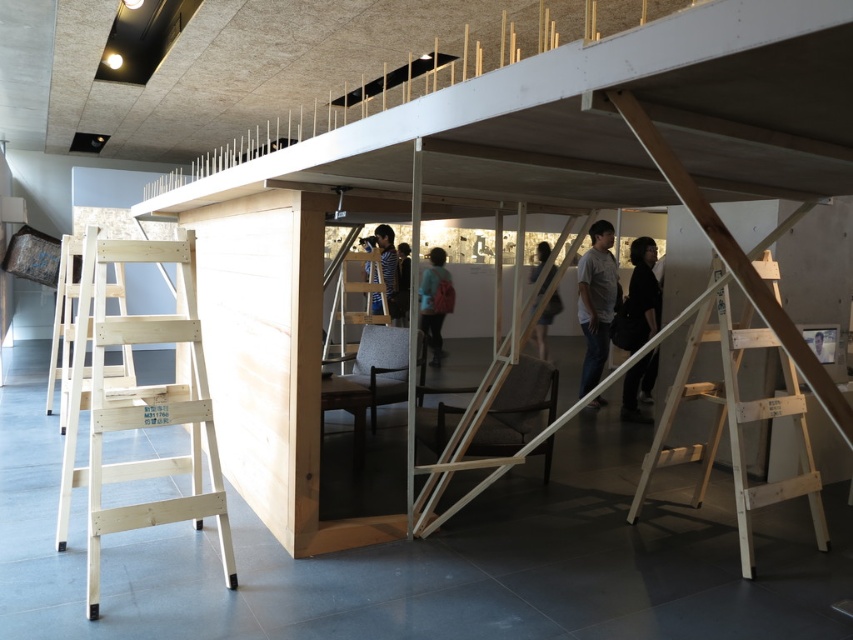
Question: Considering the real-world distances, which object is closest to the light wood ladder at left?

Choices:
 (A) wooden tripod at center
 (B) black matte clothing at center

Answer: (A)

Question: Which point is farther from the camera taking this photo?

Choices:
 (A) (659, 316)
 (B) (396, 284)

Answer: (B)

Question: Does light wood ladder at left have a greater width compared to light blue fabric jacket at center?

Choices:
 (A) no
 (B) yes

Answer: (B)

Question: Does light wood ladder at left have a larger size compared to gray cotton shirt at center?

Choices:
 (A) no
 (B) yes

Answer: (B)

Question: Is wooden tripod at center to the left of dark gray fabric chair at center from the viewer's perspective?

Choices:
 (A) yes
 (B) no

Answer: (A)

Question: Which of these objects is positioned farthest from the wooden ladder at center?

Choices:
 (A) light blue fabric jacket at center
 (B) light brown wooden ladder at right

Answer: (B)